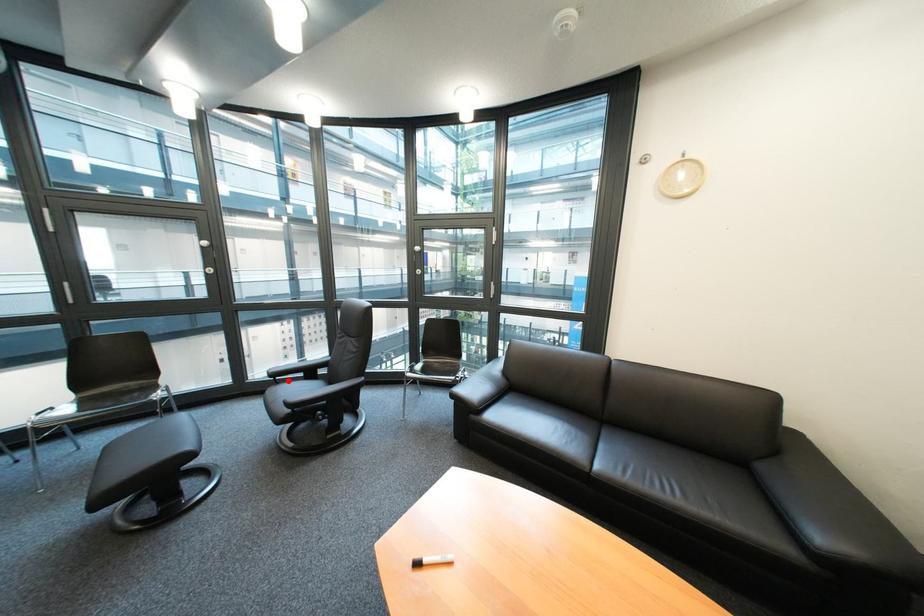
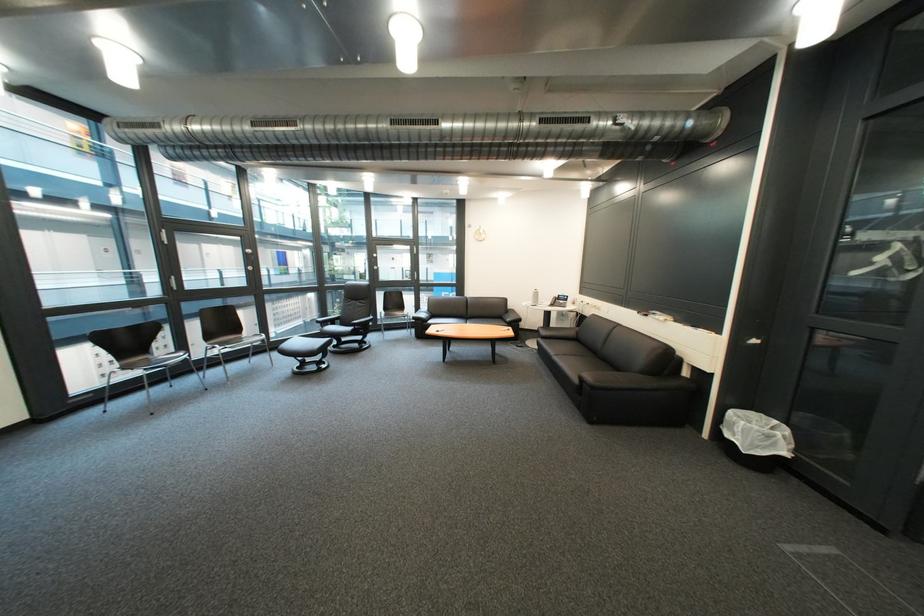
Find the pixel in the second image that matches the highlighted location in the first image.

(334, 326)